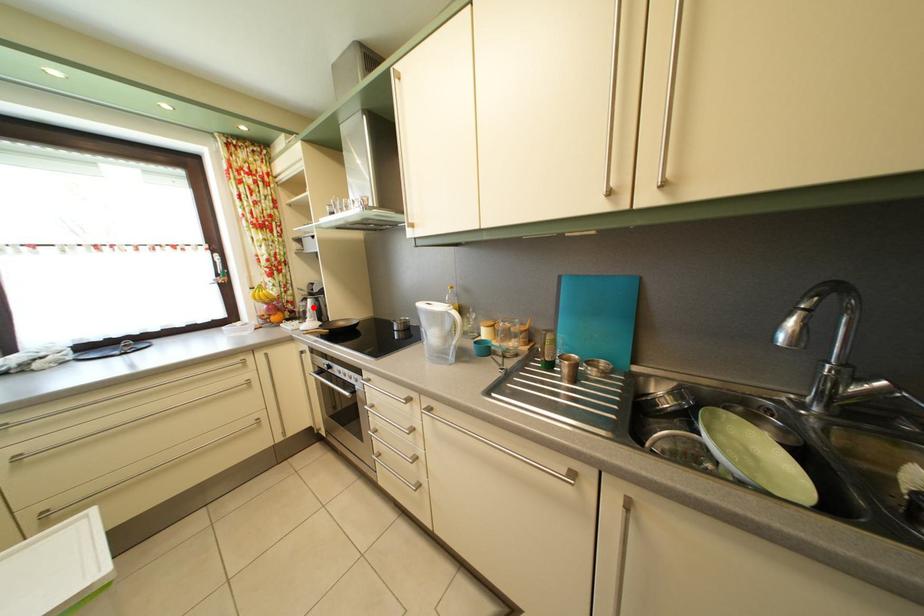
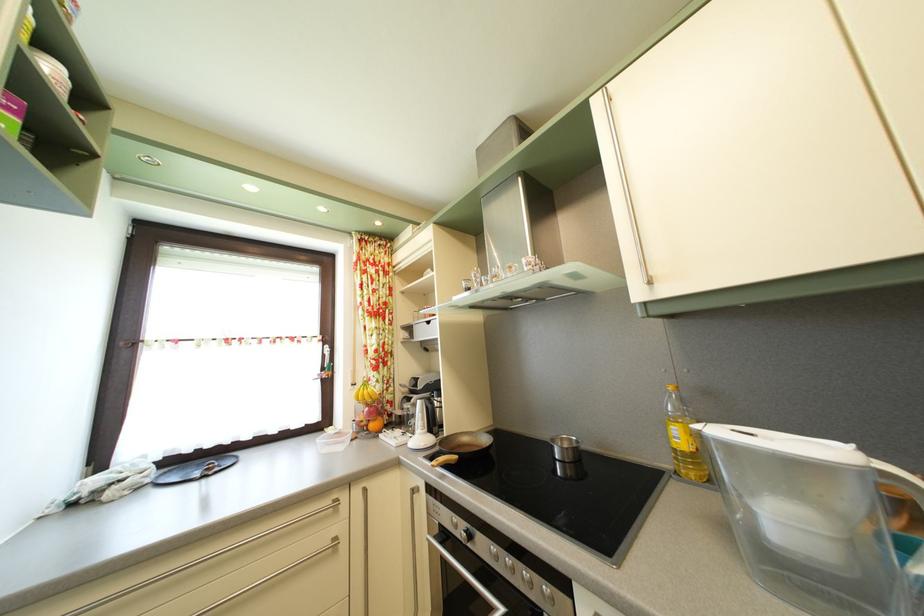
Find the pixel in the second image that matches the highlighted location in the first image.

(417, 407)